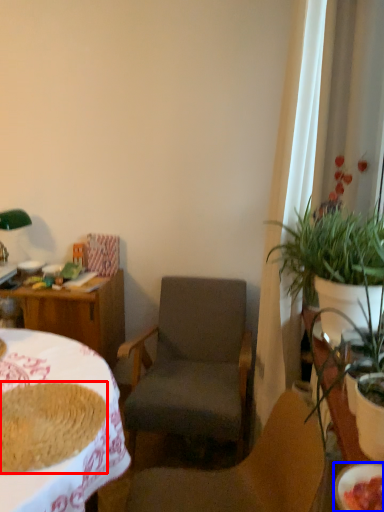
Question: Among these objects, which one is farthest to the camera, food (highlighted by a red box) or bowl (highlighted by a blue box)?

Choices:
 (A) food
 (B) bowl

Answer: (A)